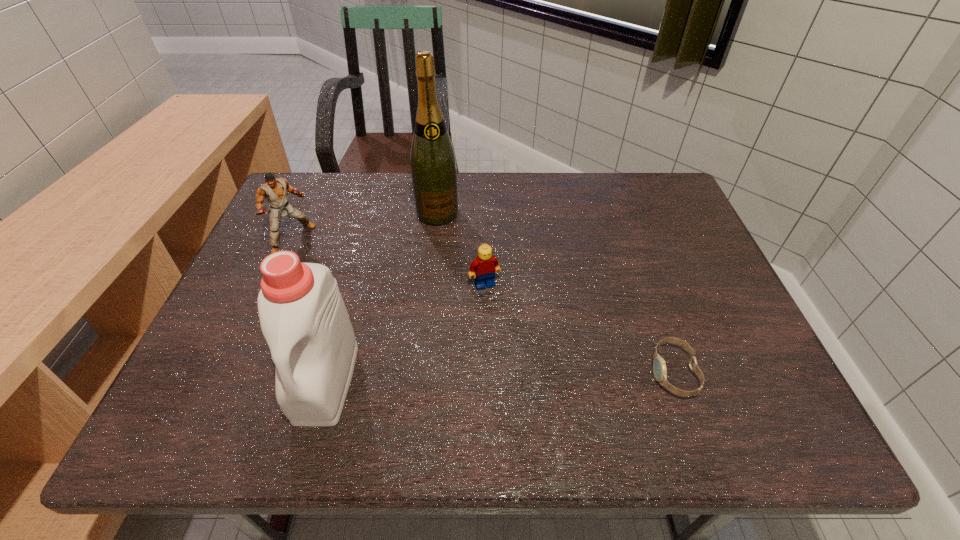
The image size is (960, 540). Identify the location of vacant space at the left edge of the desktop. (228, 308).

What are the coordinates of `free space at the right edge of the desktop` in the screenshot? It's located at (716, 279).

The width and height of the screenshot is (960, 540). Find the location of `vacant space at the far left corner of the desktop`. vacant space at the far left corner of the desktop is located at coordinates (308, 173).

This screenshot has width=960, height=540. In the image, there is a desktop. Find the location of `free space at the near right corner`. free space at the near right corner is located at coordinates (756, 370).

Find the location of a particular element. This screenshot has height=540, width=960. free spot between the rightmost object and the third object from left to right is located at coordinates (556, 293).

What are the coordinates of `blank region between the fourth tallest object and the puncher` in the screenshot? It's located at (390, 262).

What are the coordinates of `empty space between the fourth shortest object and the Lego` in the screenshot? It's located at (405, 332).

What are the coordinates of `blank region between the third object from right to left and the leftmost object` in the screenshot? It's located at (366, 227).

I want to click on free spot between the third nearest object and the third shortest object, so click(x=390, y=262).

Where is `vacant area between the third object from left to right and the leftmost object`? This screenshot has width=960, height=540. vacant area between the third object from left to right and the leftmost object is located at coordinates (366, 227).